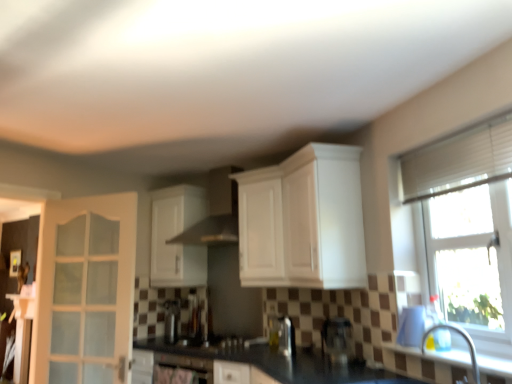
Locate an element on the screen. The image size is (512, 384). vacant space in front of satin black coffee machine at center, the 2th coffee machine positioned from the left is located at coordinates (333, 375).